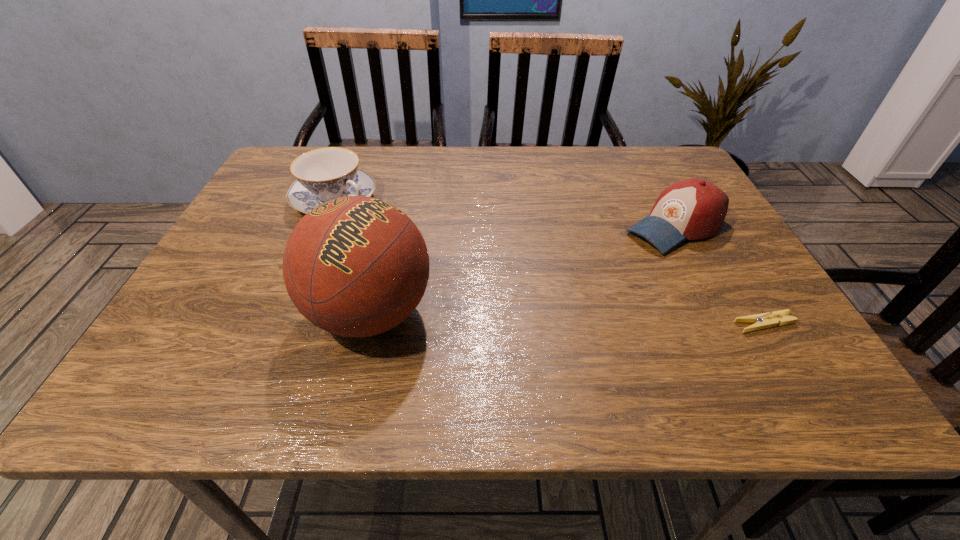
You are a GUI agent. You are given a task and a screenshot of the screen. Output one action in this format:
    pyautogui.click(x=<x>, y=<y>)
    Task: Click on the tallest object
    This screenshot has height=540, width=960.
    Given the screenshot: What is the action you would take?
    pyautogui.click(x=356, y=266)

Find the location of a particular element. clothespin is located at coordinates (765, 320).

Identify the location of baseball cap. This screenshot has width=960, height=540. (691, 209).

The height and width of the screenshot is (540, 960). I want to click on chinaware, so click(324, 174).

Where is `vacant space located 0.100m on the right of the tallest object`? vacant space located 0.100m on the right of the tallest object is located at coordinates (486, 314).

The image size is (960, 540). Identify the location of free region located on the back of the clothespin. (713, 239).

Where is `blank space located 0.300m on the front-facing side of the baseball cap`? The image size is (960, 540). blank space located 0.300m on the front-facing side of the baseball cap is located at coordinates (540, 300).

Locate an element on the screen. The image size is (960, 540). vacant region located on the front-facing side of the baseball cap is located at coordinates (512, 316).

The image size is (960, 540). Identify the location of free location located on the front-facing side of the baseball cap. (508, 318).

The width and height of the screenshot is (960, 540). What are the coordinates of `free region located 0.150m with the handle on the side of the chinaware` in the screenshot? It's located at (411, 237).